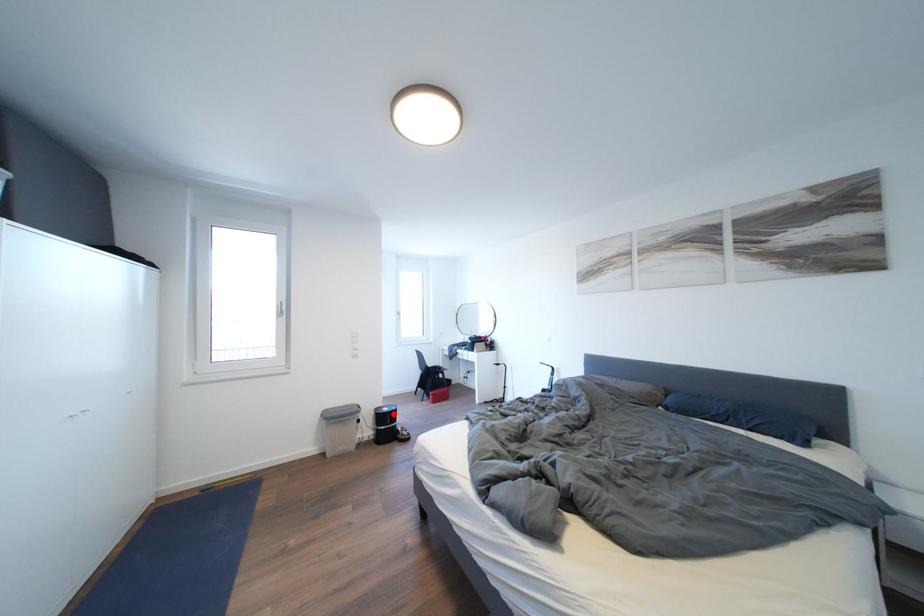
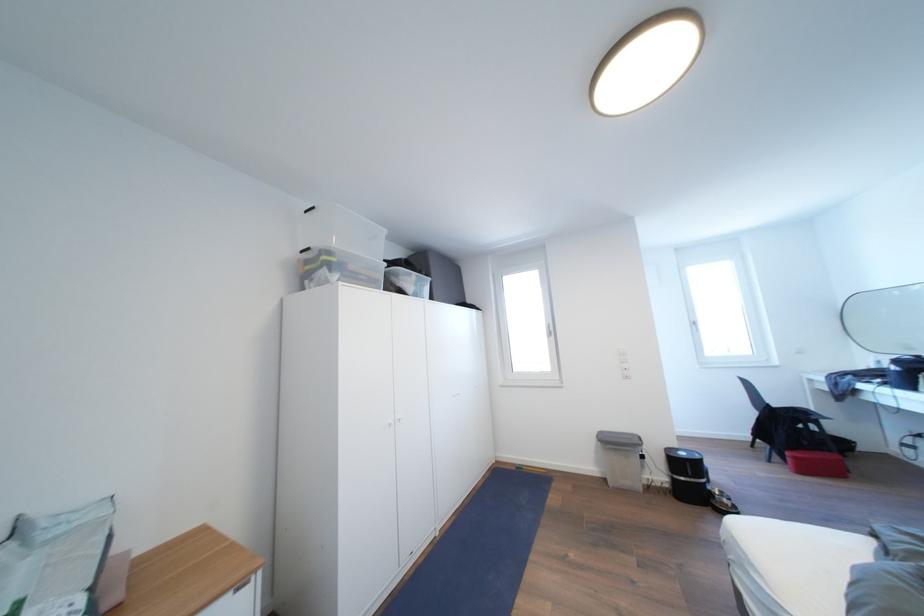
Question: I am providing you with two images of the same scene from different viewpoints. In image1, a red point is highlighted. Considering the same 3D point in image2, which of the following is correct?

Choices:
 (A) It is closer
 (B) It is farther

Answer: (B)